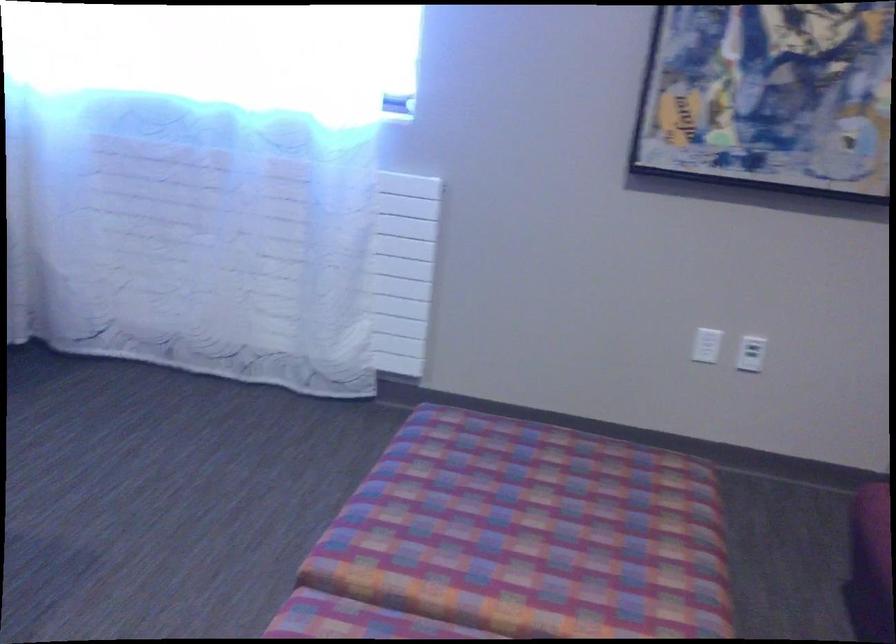
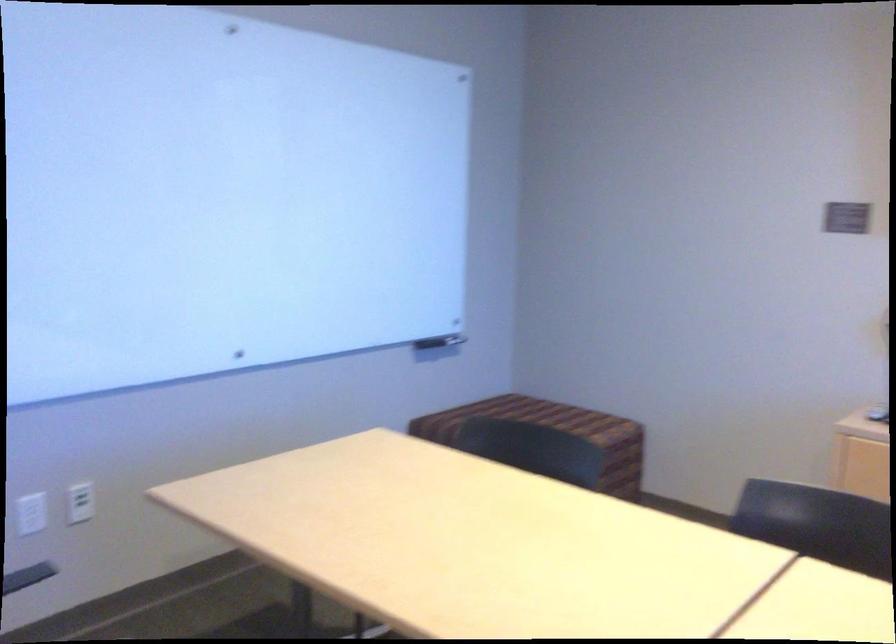
Based on the continuous images, in which direction is the camera rotating?

The rotation direction of the camera is left-down.